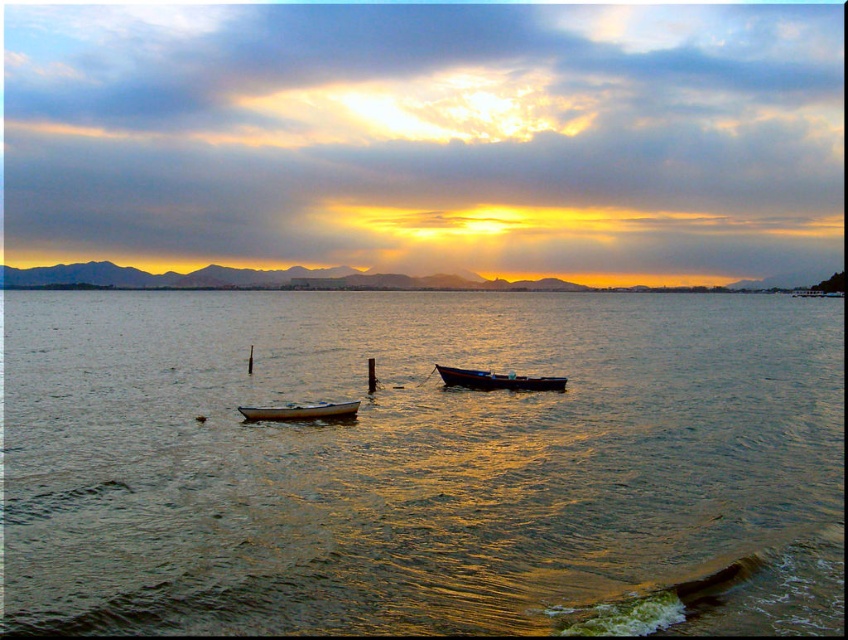
You are standing on the shore of the lake and see two points in the water. The first point is at coordinate point (562, 538) and the second is at point (289, 412). Which point is closer to you?

Point (562, 538) is in front of point (289, 412), so it is closer to you.